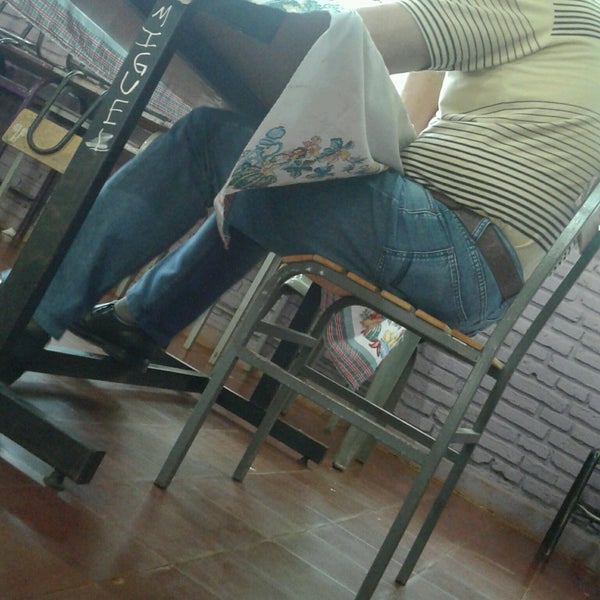
At what (x,y) coordinates should I click in order to perform the action: click on white flower table cloth. Please return your answer as a coordinate pair (x, y). Looking at the image, I should click on (308, 110).